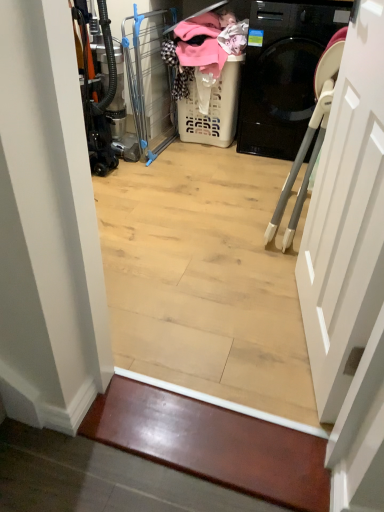
You are a GUI agent. You are given a task and a screenshot of the screen. Output one action in this format:
    pyautogui.click(x=<x>, y=<y>)
    Task: Click on the free location to the left of white matte door at right
    
    Given the screenshot: What is the action you would take?
    pyautogui.click(x=213, y=317)